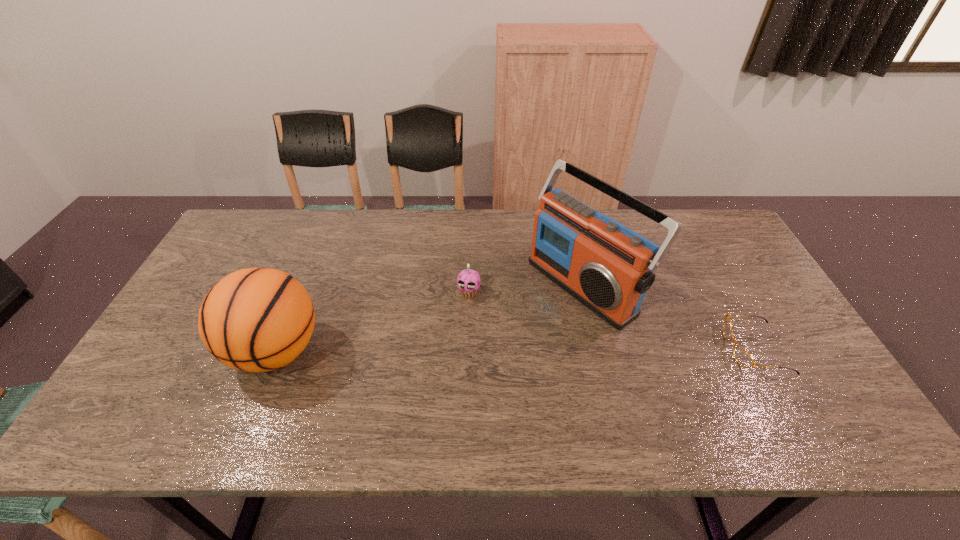
Find the location of a particular element. This screenshot has width=960, height=540. free space located on the front-facing side of the shortest object is located at coordinates (682, 349).

You are a GUI agent. You are given a task and a screenshot of the screen. Output one action in this format:
    pyautogui.click(x=<x>, y=<y>)
    Task: Click on the free space located on the front-facing side of the shortest object
    The image size is (960, 540).
    Given the screenshot: What is the action you would take?
    pyautogui.click(x=643, y=349)

Find the location of a particular element. free space located 0.280m on the front-facing side of the radio receiver is located at coordinates (468, 366).

The width and height of the screenshot is (960, 540). I want to click on vacant space located on the front-facing side of the radio receiver, so click(431, 390).

Where is `free space located on the front-facing side of the radio receiver`? The image size is (960, 540). free space located on the front-facing side of the radio receiver is located at coordinates (483, 355).

Locate an element on the screen. Image resolution: width=960 pixels, height=540 pixels. free space located on the face of the cupcake is located at coordinates (434, 394).

Find the location of a particular element. This screenshot has width=960, height=540. free region located on the face of the cupcake is located at coordinates click(445, 360).

Where is `vacant space located on the face of the cupcake`? vacant space located on the face of the cupcake is located at coordinates (461, 316).

Image resolution: width=960 pixels, height=540 pixels. I want to click on object located in the far edge section of the desktop, so click(x=608, y=267).

Where is `basketball present at the near edge`? This screenshot has height=540, width=960. basketball present at the near edge is located at coordinates (257, 319).